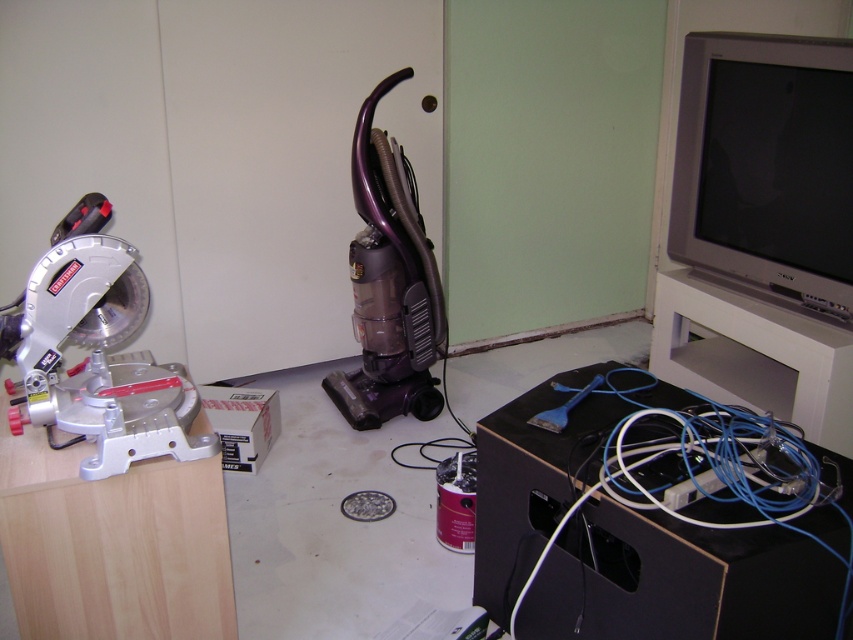
Question: Which object is closer to the camera taking this photo?

Choices:
 (A) purple plastic vacuum cleaner at center
 (B) silver metallic miter saw at left

Answer: (B)

Question: Which of the following is the farthest from the observer?

Choices:
 (A) (142, 429)
 (B) (558, 420)
 (C) (697, 420)

Answer: (B)

Question: Can you confirm if blue cable at lower right is bigger than blue rubber spatula at center?

Choices:
 (A) no
 (B) yes

Answer: (B)

Question: Is silver metallic miter saw at left above blue rubber spatula at center?

Choices:
 (A) yes
 (B) no

Answer: (A)

Question: Estimate the real-world distances between objects in this image. Which object is closer to the blue rubber spatula at center?

Choices:
 (A) purple plastic vacuum cleaner at center
 (B) blue cable at lower right
 (C) silver metallic miter saw at left

Answer: (B)

Question: Where is blue cable at lower right located in relation to purple plastic vacuum cleaner at center in the image?

Choices:
 (A) left
 (B) right

Answer: (B)